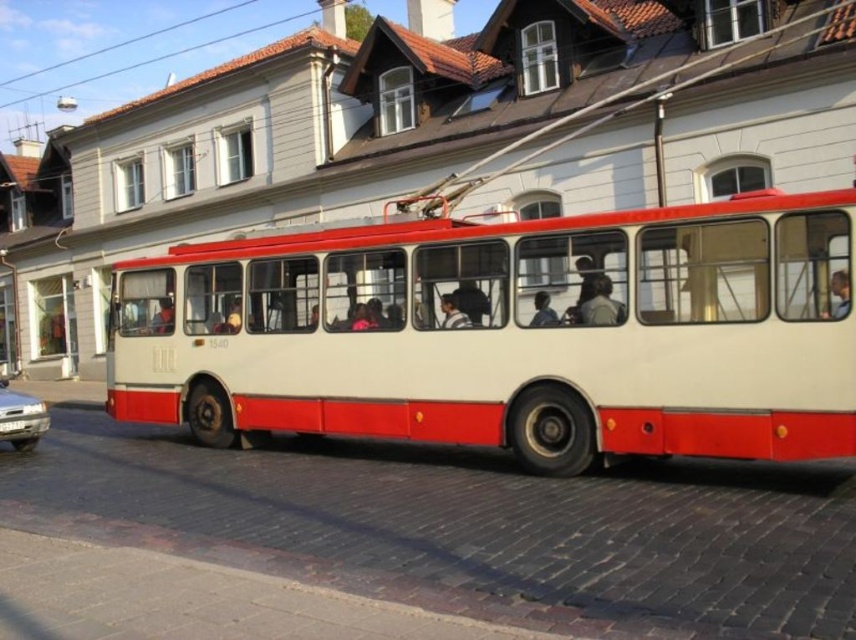
You are a photographer standing on the cobblestone street. You want to take a photo of the smooth beige jacket at center and the smooth skin face at center. Which object should you focus on first if you want both to be in sharp focus?

The smooth skin face at center is behind the smooth beige jacket at center, so you should focus on the smooth beige jacket at center first to ensure both are in sharp focus.

You are a delivery person needing to park your 5.5 meter long van between the white matte bus at center and the silver metallic car at lower left. Is there enough space for your van to fit between them?

The white matte bus at center and the silver metallic car at lower left are 6.29 meters apart from each other. Since your van is 5.5 meters long, there is enough space for it to fit between them as 6.29 meters is greater than 5.5 meters.

Looking at this image, you are a photographer standing in front of the red and cream trolleybus. You notice two subjects in the scene, the smooth beige jacket at center and the smooth skin face at center. Which subject would appear larger in your photo?

The smooth beige jacket at center is bigger than the smooth skin face at center, so it would appear larger in the photo.